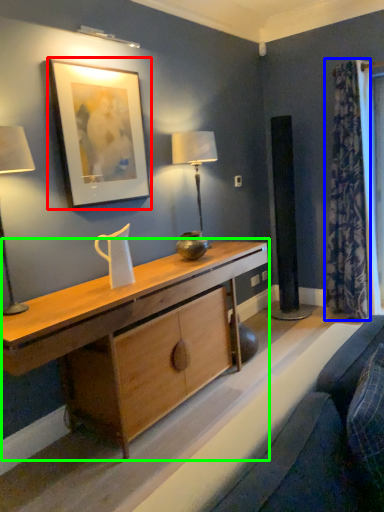
Question: Based on their relative distances, which object is nearer to picture frame (highlighted by a red box)? Choose from curtain (highlighted by a blue box) and desk (highlighted by a green box).

Choices:
 (A) curtain
 (B) desk

Answer: (B)